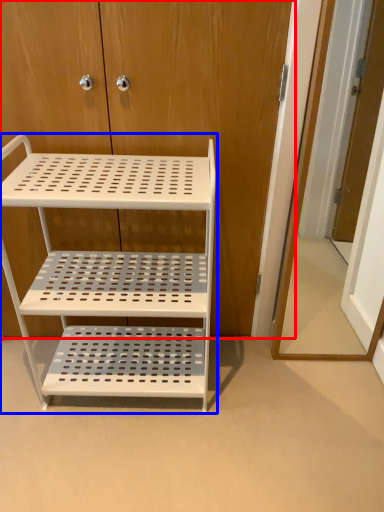
Question: Which point is closer to the camera, dresser (highlighted by a red box) or shelf (highlighted by a blue box)?

Choices:
 (A) dresser
 (B) shelf

Answer: (B)